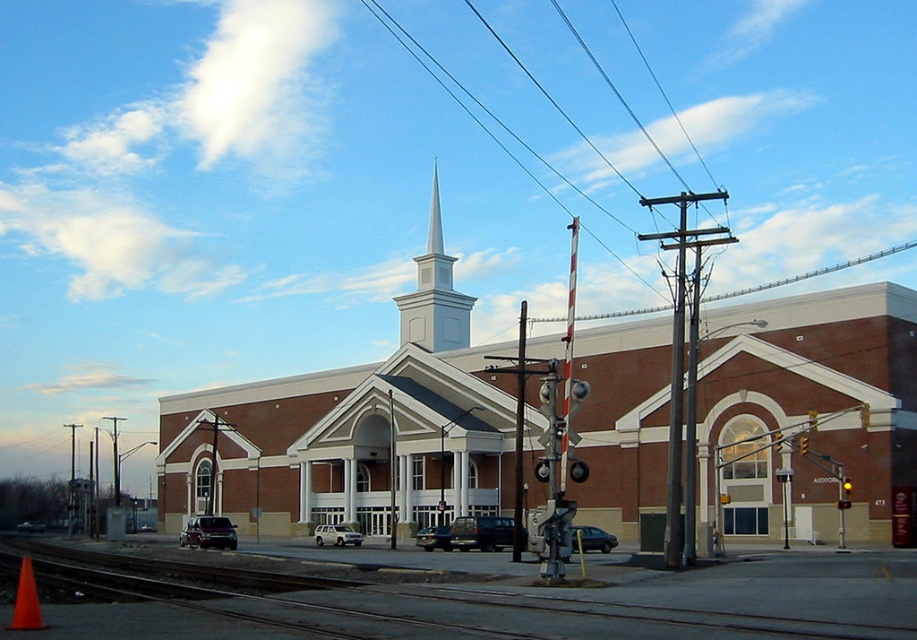
Question: Does smooth wire at upper center have a lesser width compared to orange plastic cone at lower left?

Choices:
 (A) no
 (B) yes

Answer: (A)

Question: Which point appears closest to the camera in this image?

Choices:
 (A) (761, 369)
 (B) (851, 488)
 (C) (15, 608)
 (D) (555, 320)

Answer: (C)

Question: Does white smooth steeple at center have a lesser width compared to yellow matte traffic light at center right?

Choices:
 (A) yes
 (B) no

Answer: (B)

Question: Estimate the real-world distances between objects in this image. Which object is farther from the smooth asphalt train track at lower left?

Choices:
 (A) white smooth steeple at center
 (B) yellow glass traffic light at upper right
 (C) smooth wire at upper center

Answer: (C)

Question: In this image, where is brick building at center located relative to yellow glass traffic light at upper right?

Choices:
 (A) below
 (B) above

Answer: (B)

Question: Which point is farther from the camera taking this photo?

Choices:
 (A) (615, 316)
 (B) (796, 442)

Answer: (A)